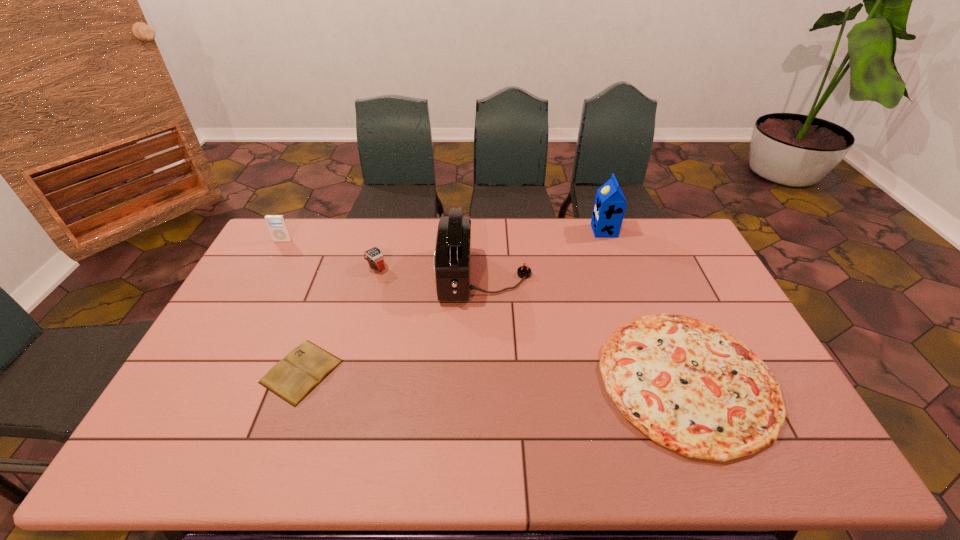
This screenshot has width=960, height=540. Find the location of `free space in the image that satisfies the following two spatial constraints: 1. with the cap open on the carton; 2. on the front-facing side of the fifth nearest object`. free space in the image that satisfies the following two spatial constraints: 1. with the cap open on the carton; 2. on the front-facing side of the fifth nearest object is located at coordinates (608, 241).

Locate an element on the screen. free location that satisfies the following two spatial constraints: 1. with the cap open on the farthest object; 2. on the front-facing side of the third tallest object is located at coordinates (608, 241).

I want to click on free location that satisfies the following two spatial constraints: 1. on the front-facing side of the leftmost object; 2. on the left side of the second shortest object, so click(x=207, y=380).

This screenshot has width=960, height=540. I want to click on vacant space that satisfies the following two spatial constraints: 1. on the front side of the second shortest object; 2. on the right side of the third shortest object, so click(347, 380).

At what (x,y) coordinates should I click in order to perform the action: click on free space that satisfies the following two spatial constraints: 1. on the front-facing side of the pizza; 2. on the left side of the iPod. Please return your answer as a coordinate pair (x, y). Image resolution: width=960 pixels, height=540 pixels. Looking at the image, I should click on (207, 380).

Image resolution: width=960 pixels, height=540 pixels. Find the location of `vacant region that satisfies the following two spatial constraints: 1. on the front-facing side of the watch; 2. on the right side of the fifth nearest object`. vacant region that satisfies the following two spatial constraints: 1. on the front-facing side of the watch; 2. on the right side of the fifth nearest object is located at coordinates [269, 267].

I want to click on free point that satisfies the following two spatial constraints: 1. with the cap open on the farthest object; 2. on the front-facing side of the leftmost object, so click(608, 241).